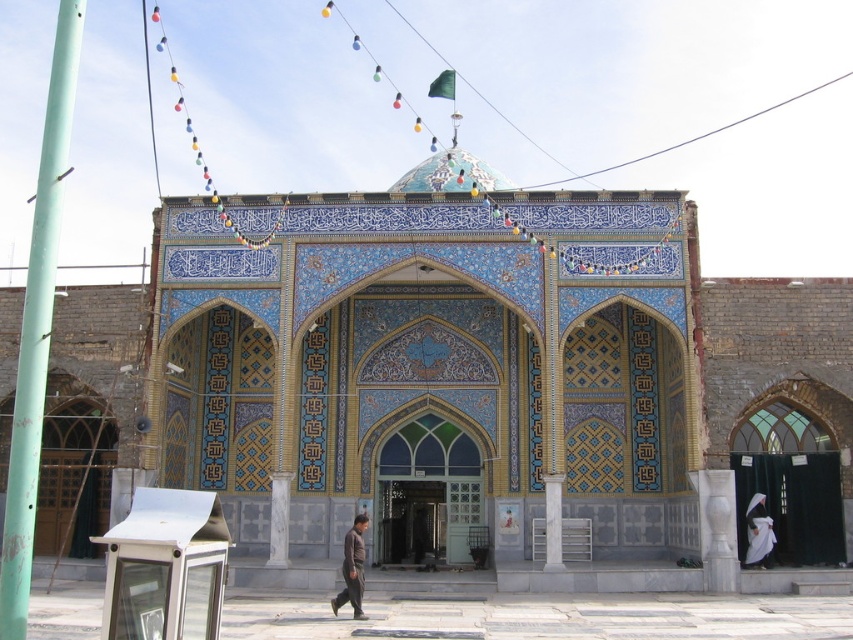
Can you confirm if green painted metal pole at left is thinner than white fabric at right?

Answer: No.

Measure the distance between point [39,189] and camera.

A distance of 132.35 feet exists between point [39,189] and camera.

Where is `green painted metal pole at left`? green painted metal pole at left is located at coordinates (38, 326).

Can you confirm if dark brown fabric at center is smaller than white fabric at right?

Incorrect, dark brown fabric at center is not smaller in size than white fabric at right.

Does dark brown fabric at center appear over white fabric at right?

Incorrect, dark brown fabric at center is not positioned above white fabric at right.

Is point (360, 552) closer to viewer compared to point (753, 513)?

That is True.

What are the coordinates of `dark brown fabric at center` in the screenshot? It's located at (352, 568).

Is green painted metal pole at left to the left of dark brown fabric at center from the viewer's perspective?

Indeed, green painted metal pole at left is positioned on the left side of dark brown fabric at center.

Who is shorter, green painted metal pole at left or dark brown fabric at center?

With less height is dark brown fabric at center.

Is point (6, 634) positioned in front of point (361, 596)?

Yes.

You are a GUI agent. You are given a task and a screenshot of the screen. Output one action in this format:
    pyautogui.click(x=<x>, y=<y>)
    Task: Click on the green painted metal pole at left
    This screenshot has height=640, width=853.
    Given the screenshot: What is the action you would take?
    click(x=38, y=326)